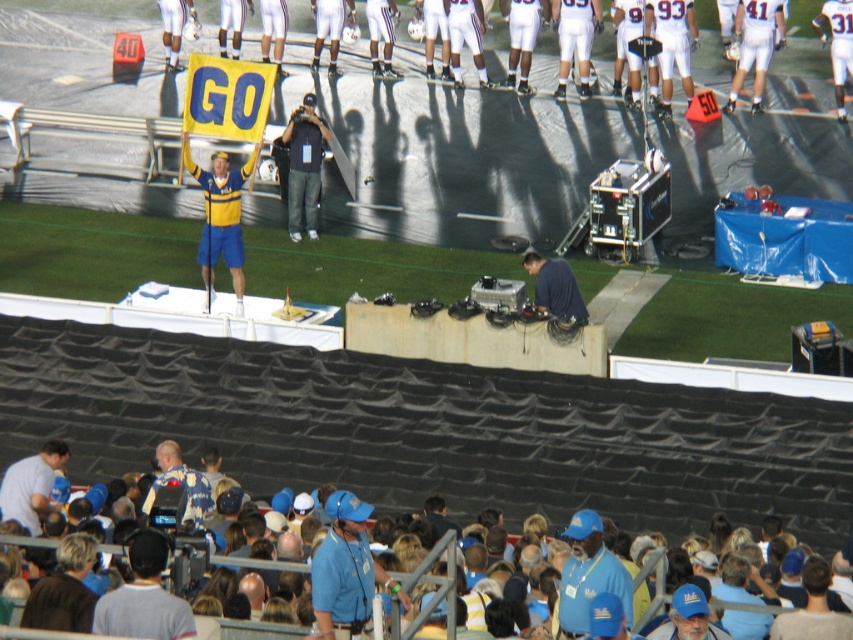
In the scene shown: You are a photographer trying to capture a clear shot of the dark blue shirt at center and the blue fabric cap at lower right. Since you want both objects to appear equally prominent in the photo, which object should you move closer to or farther away from the camera?

The dark blue shirt at center is larger in size than the blue fabric cap at lower right. To make both appear equally prominent in the photo, you should move the dark blue shirt at center farther away from the camera and bring the blue fabric cap at lower right closer to the camera. This adjustment balances their sizes in the frame.

You are a photographer standing at the edge of the field and want to take a photo that includes both the dark blue shirt at center and the blue fabric cap at lower right. The minimum distance between the two objects in the photo should be 6 meters. Can you position yourself so that both are in the frame with the required separation?

Yes, since the dark blue shirt at center is 6.64 meters away from the blue fabric cap at lower right, which exceeds the minimum required separation of 6 meters, you can position yourself to include both in the frame with the necessary distance between them.

You are a photographer at the stadium and want to take a photo of both the blue fabric at lower center and the blue fabric hat at lower right. Which object should you focus on first to ensure it appears sharp in the photo?

You should focus on the blue fabric at lower center first because it is closer to you than the blue fabric hat at lower right, so focusing on it will ensure it stays sharp while the hat may appear slightly out of focus if the depth of field is limited.